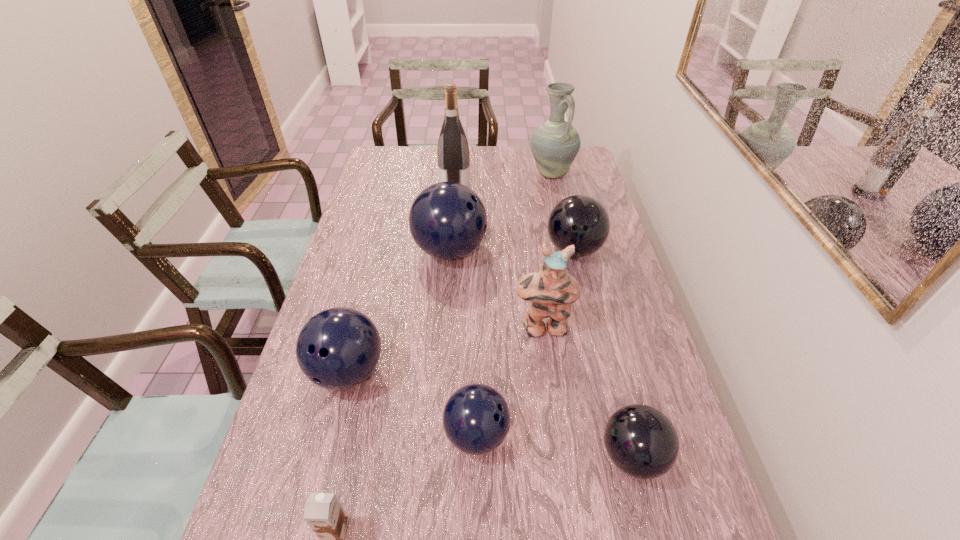
Locate an element on the screen. Image resolution: width=960 pixels, height=540 pixels. blank area located on the side of the nearer black bowling ball with the finger holes is located at coordinates (478, 456).

Find the location of a particular element. object that is positioned at the far edge is located at coordinates (x=555, y=144).

Image resolution: width=960 pixels, height=540 pixels. Find the location of `object located at the left edge`. object located at the left edge is located at coordinates (338, 348).

Image resolution: width=960 pixels, height=540 pixels. In order to click on pitcher that is at the right edge in this screenshot , I will do `click(555, 144)`.

Identify the location of object located at the far right corner. Image resolution: width=960 pixels, height=540 pixels. (555, 144).

Locate an element on the screen. vacant space at the far edge of the desktop is located at coordinates (515, 157).

The width and height of the screenshot is (960, 540). Identify the location of vacant region at the left edge of the desktop. (347, 300).

Find the location of a particular element. vacant space at the right edge is located at coordinates (628, 396).

Locate an element on the screen. blank area at the far left corner is located at coordinates (382, 156).

Find the location of a particular element. This screenshot has width=960, height=540. vacant point located between the farther black bowling ball and the smaller black bowling ball is located at coordinates (603, 353).